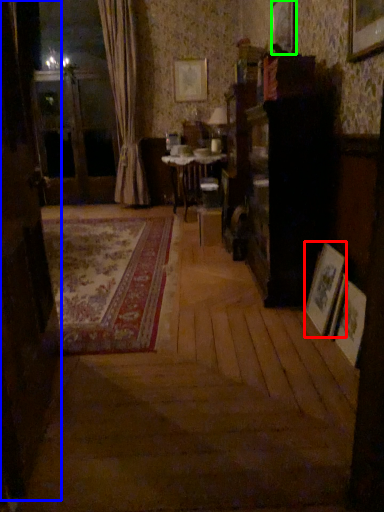
Question: Which object is positioned closest to picture frame (highlighted by a red box)? Select from screen door (highlighted by a blue box) and picture frame (highlighted by a green box).

Choices:
 (A) screen door
 (B) picture frame

Answer: (A)